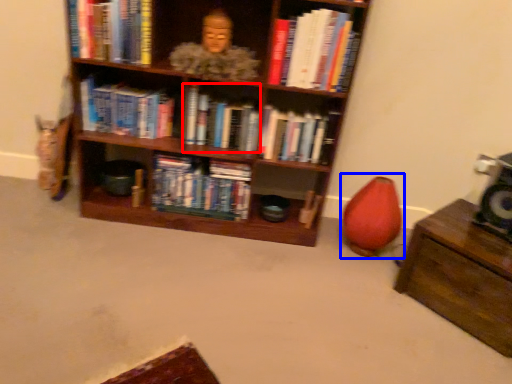
Question: Which point is closer to the camera, book (highlighted by a red box) or bean bag chair (highlighted by a blue box)?

Choices:
 (A) book
 (B) bean bag chair

Answer: (B)